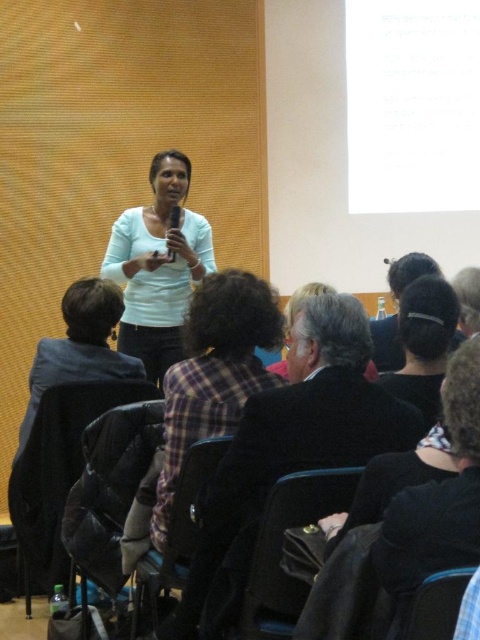
You are organizing a photo shoot and need to ensure that the dark brown leather jacket at center and the dark hair at center are both visible in the frame. Given their sizes, which object should you prioritize positioning closer to the camera to maintain clarity?

The dark brown leather jacket at center has a larger size compared to dark hair at center, so you should prioritize positioning the dark brown leather jacket at center closer to the camera to maintain clarity.